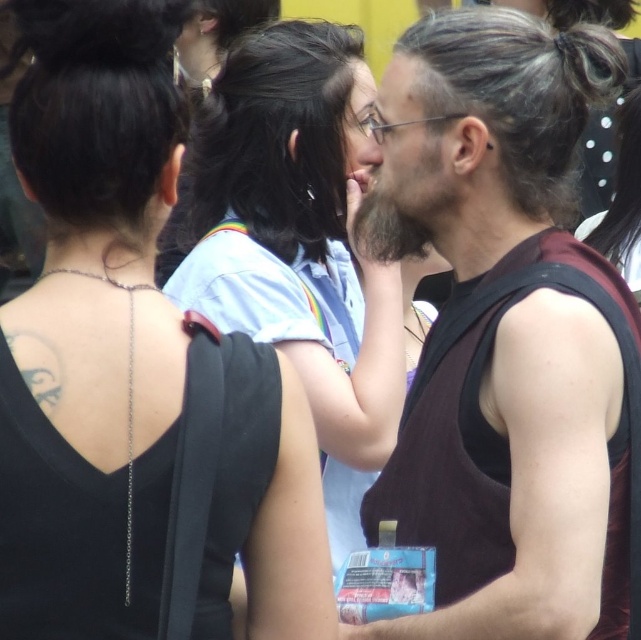
You are standing in the crowd at this gathering and want to get a better view of the two foreground individuals. If you move forward, which of the two points, point (342, 96) or point (367, 134), will become closer to you first?

Point (342, 96) is closer to the viewer than point 0.212, 0.535. Moving forward, point (342, 96) would become closer first since it is already nearer to you initially.

You are a photographer trying to capture a closeup shot of both the black shiny hair at center and the matte skin nose at center. Which object should you focus on first if you want to ensure both are in focus?

The black shiny hair at center is positioned on the left side of matte skin nose at center, so you should focus on the matte skin nose at center first as it is closer to the camera.